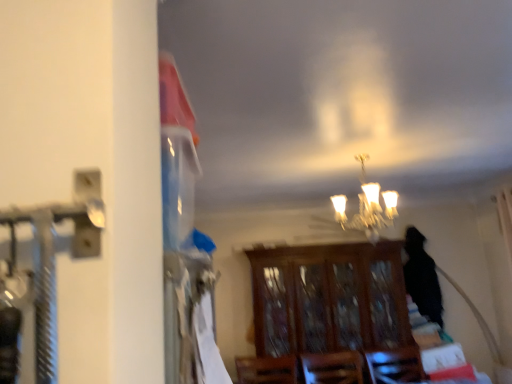
Question: Considering the positions of wooden cabinet at center and matte glass chandelier at center in the image, is wooden cabinet at center wider or thinner than matte glass chandelier at center?

Choices:
 (A) wide
 (B) thin

Answer: (A)

Question: From their relative heights in the image, would you say wooden cabinet at center is taller or shorter than matte glass chandelier at center?

Choices:
 (A) tall
 (B) short

Answer: (A)

Question: Do you think wooden cabinet at center is within matte glass chandelier at center, or outside of it?

Choices:
 (A) inside
 (B) outside

Answer: (B)

Question: From a real-world perspective, is matte glass chandelier at center physically located above or below wooden cabinet at center?

Choices:
 (A) below
 (B) above

Answer: (B)

Question: Is matte glass chandelier at center situated inside wooden cabinet at center or outside?

Choices:
 (A) inside
 (B) outside

Answer: (B)

Question: Looking at their shapes, would you say matte glass chandelier at center is wider or thinner than wooden cabinet at center?

Choices:
 (A) thin
 (B) wide

Answer: (A)

Question: Is matte glass chandelier at center taller or shorter than wooden cabinet at center?

Choices:
 (A) tall
 (B) short

Answer: (B)